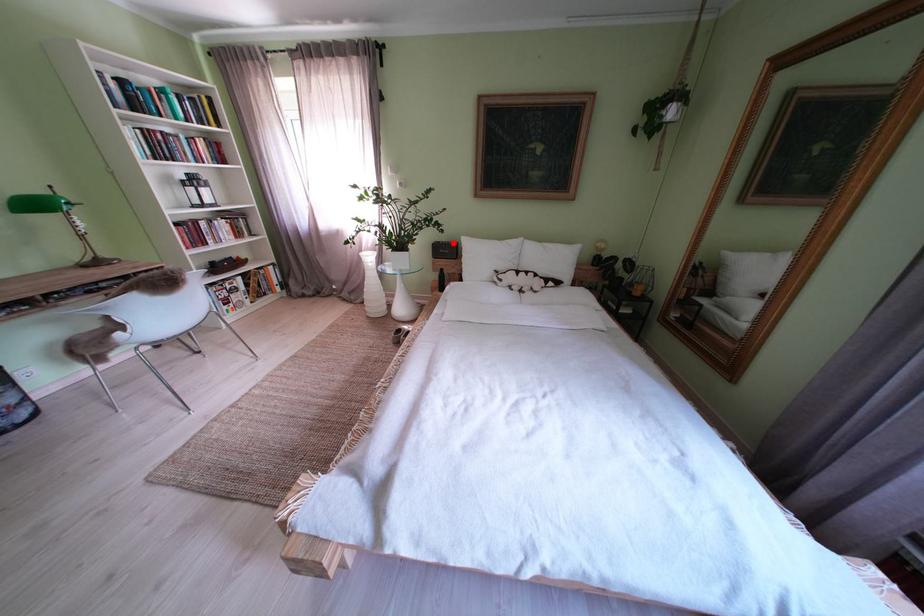
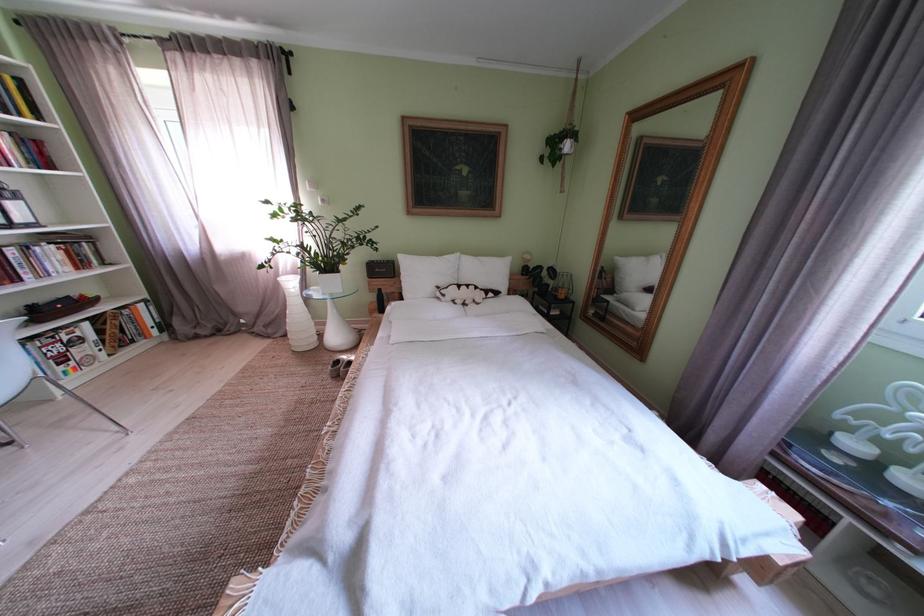
In the second image, find the point that corresponds to the highlighted location in the first image.

(387, 262)